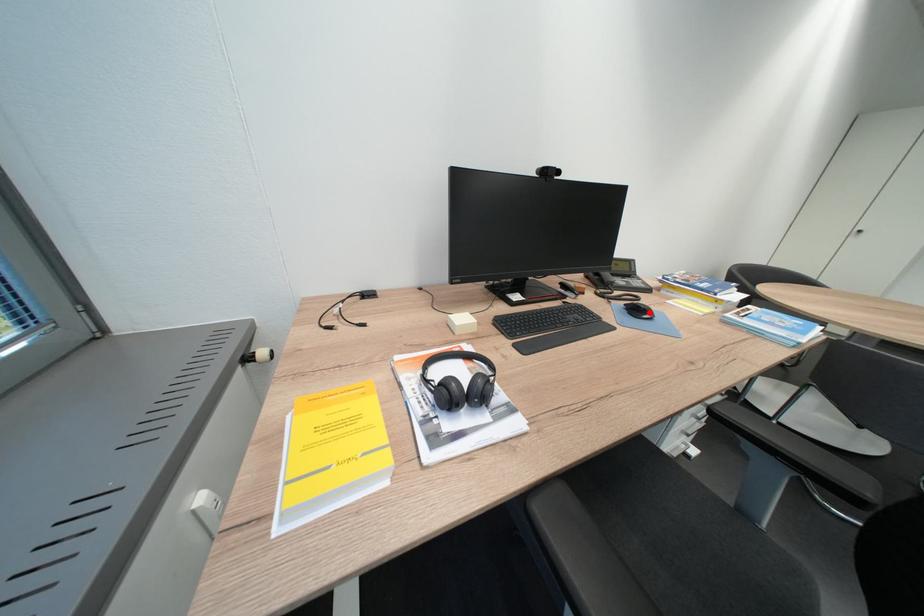
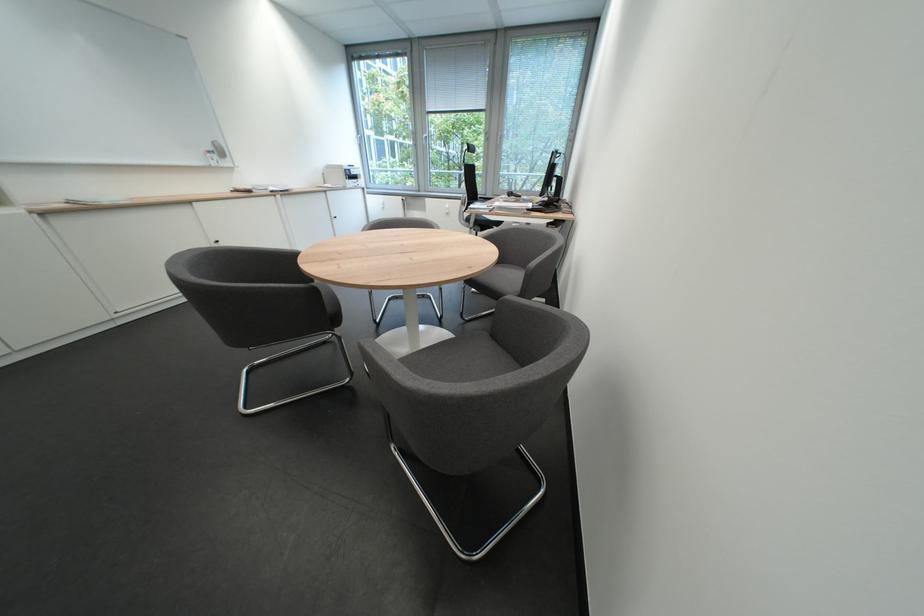
Question: I am providing you with two images of the same scene from different viewpoints. A red point is marked on the first image. Can you still see the location of the red point in image 2?

Choices:
 (A) Yes
 (B) No

Answer: (B)